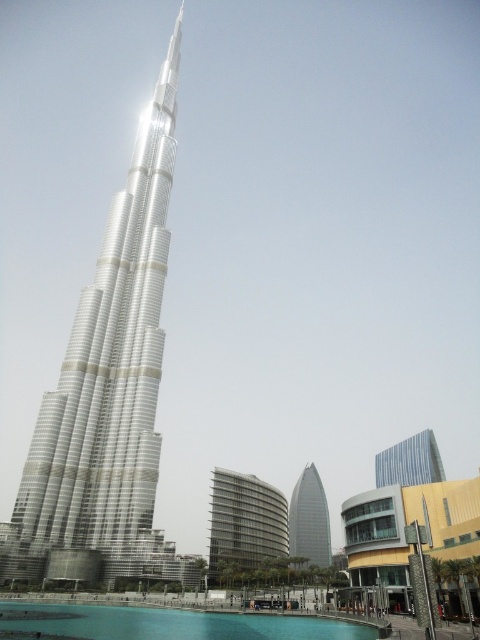
Who is more distant from viewer, (132, 608) or (308, 540)?

Point (308, 540)

Is green glass pool at lower center shorter than glassy silver tower at center?

Yes, green glass pool at lower center is shorter than glassy silver tower at center.

Locate an element on the screen. This screenshot has width=480, height=640. green glass pool at lower center is located at coordinates pyautogui.click(x=169, y=624).

Is point (242, 538) behind point (310, 484)?

That is False.

Can you confirm if metallic glass building at center is wider than glassy silver tower at center?

Yes, metallic glass building at center is wider than glassy silver tower at center.

Is point (250, 550) positioned before point (296, 502)?

Yes, point (250, 550) is in front of point (296, 502).

The image size is (480, 640). I want to click on metallic glass building at center, so coord(244,522).

From the picture: Does shiny glass tower at center appear on the right side of green glass pool at lower center?

No, shiny glass tower at center is not to the right of green glass pool at lower center.

Measure the distance between point (69, 410) and camera.

The distance of point (69, 410) from camera is 95.32 meters.

At what (x,y) coordinates should I click in order to perform the action: click on shiny glass tower at center. Please return your answer as a coordinate pair (x, y). The height and width of the screenshot is (640, 480). Looking at the image, I should click on (108, 385).

Locate an element on the screen. shiny glass tower at center is located at coordinates (108, 385).